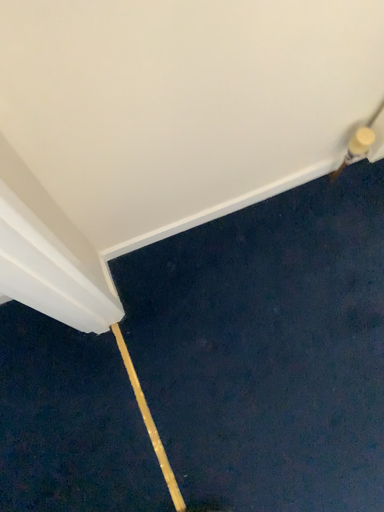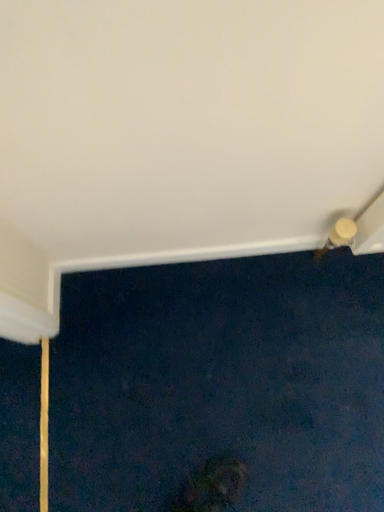
Question: How did the camera likely rotate when shooting the video?

Choices:
 (A) rotated right
 (B) rotated left

Answer: (B)